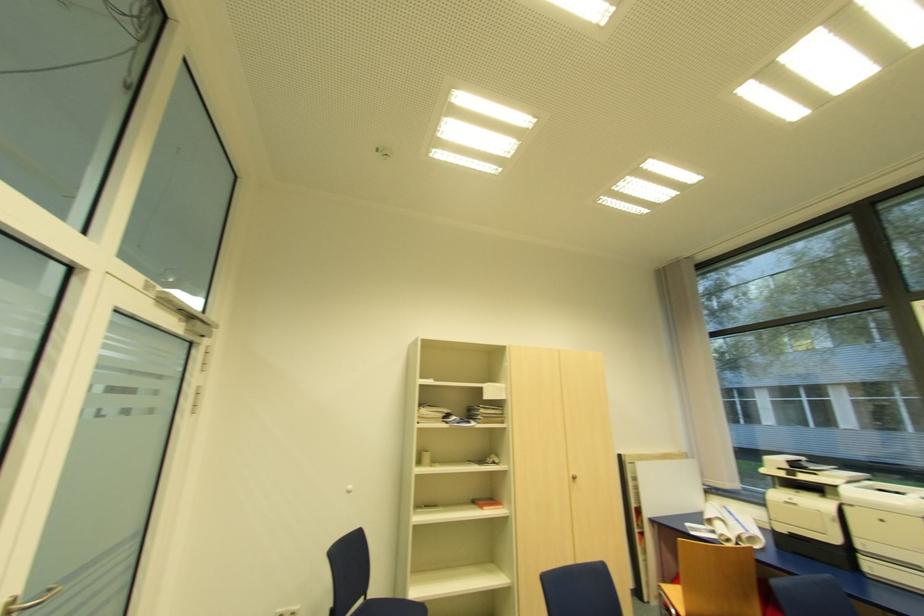
The image size is (924, 616). What are the coordinates of `wooden chair sitting surface` in the screenshot? It's located at (674, 594).